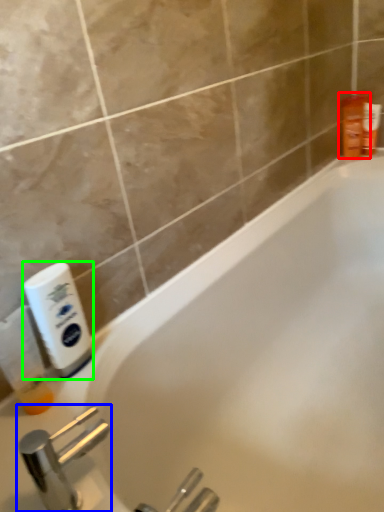
Question: Which object is the farthest from toiletry (highlighted by a red box)? Choose among these: tap (highlighted by a blue box) or cleaning product (highlighted by a green box).

Choices:
 (A) tap
 (B) cleaning product

Answer: (A)